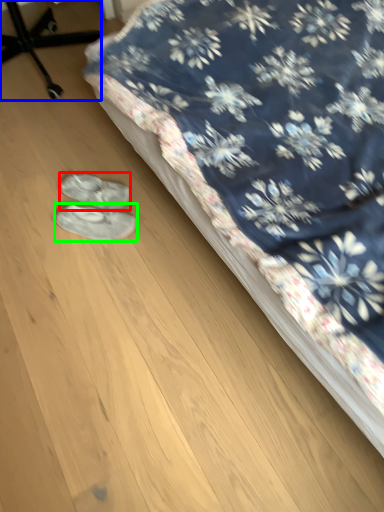
Question: Estimate the real-world distances between objects in this image. Which object is closer to footwear (highlighted by a red box), furniture (highlighted by a blue box) or footwear (highlighted by a green box)?

Choices:
 (A) furniture
 (B) footwear

Answer: (B)